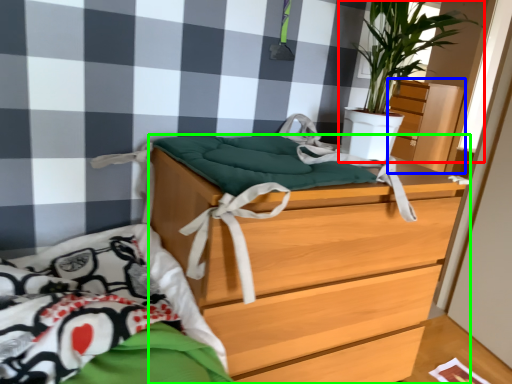
Question: Which object is positioned closest to houseplant (highlighted by a red box)? Select from dresser (highlighted by a blue box) and chest of drawers (highlighted by a green box).

Choices:
 (A) dresser
 (B) chest of drawers

Answer: (B)